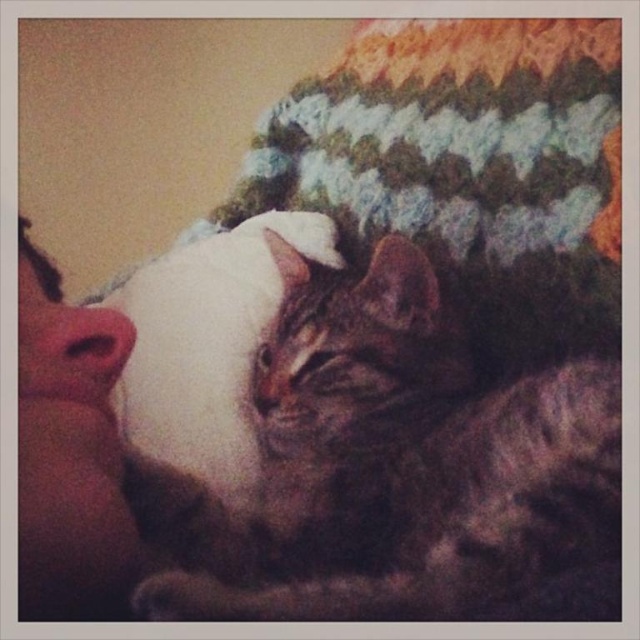
Is the position of tabby fur cat at center less distant than that of white fluffy pillow at center?

Yes, tabby fur cat at center is closer to the viewer.

Can you confirm if tabby fur cat at center is shorter than white fluffy pillow at center?

Indeed, tabby fur cat at center has a lesser height compared to white fluffy pillow at center.

Between point (276, 486) and point (152, 452), which one is positioned in front?

Point (276, 486) is in front.

Find the location of `tabby fur cat at center`. tabby fur cat at center is located at coordinates (394, 467).